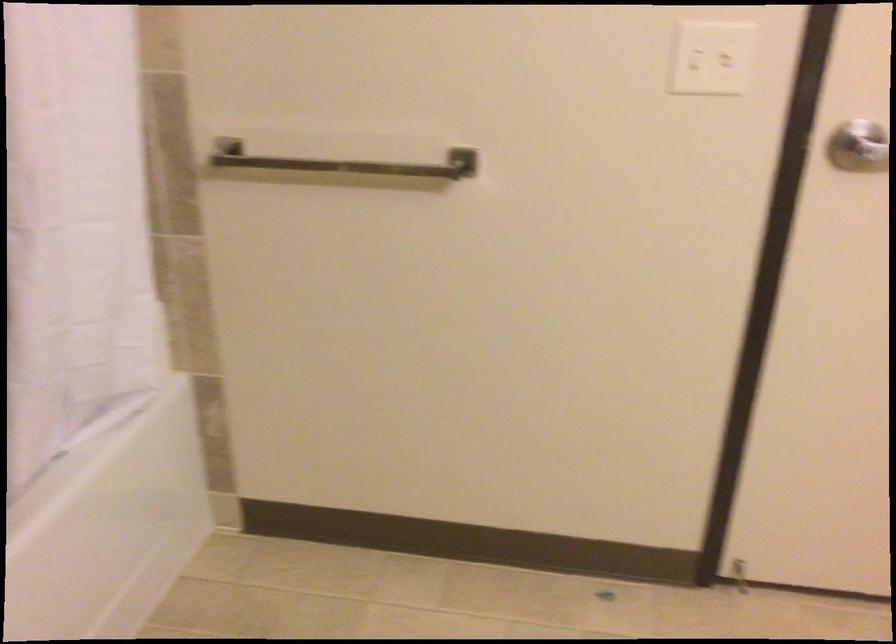
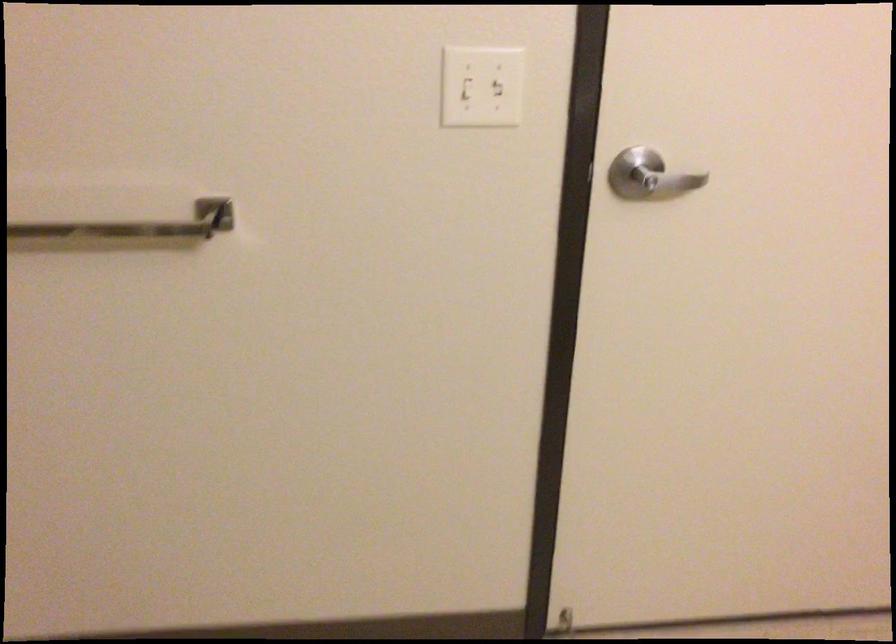
Question: Based on the continuous images, in which direction is the camera rotating? Reply with the corresponding letter.

Choices:
 (A) Left
 (B) Right
 (C) Up
 (D) Down

Answer: (B)